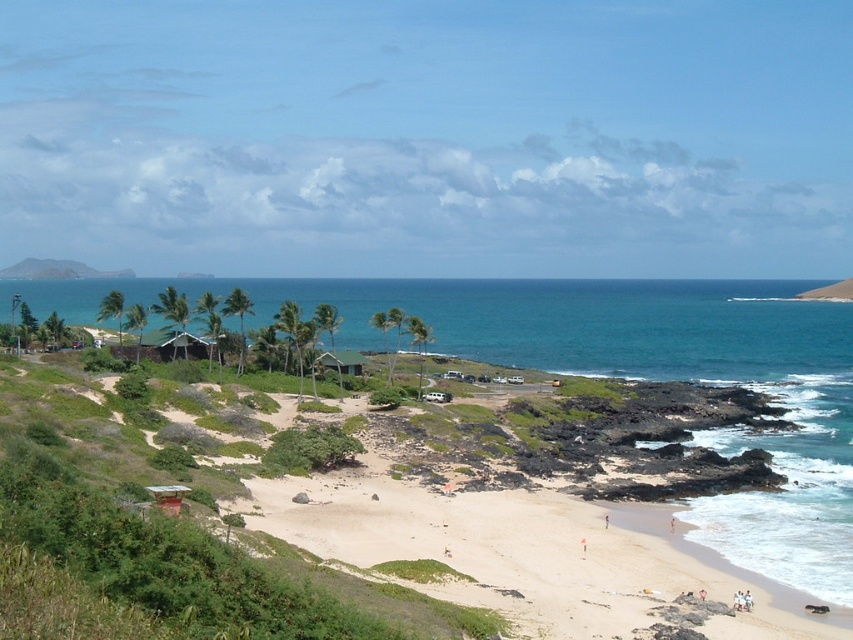
How much distance is there between blue water at center and green matte hut at center?

The distance of blue water at center from green matte hut at center is 388.37 feet.

Between point (537, 332) and point (346, 364), which one is positioned in front?

Point (346, 364)

I want to click on blue water at center, so click(x=624, y=376).